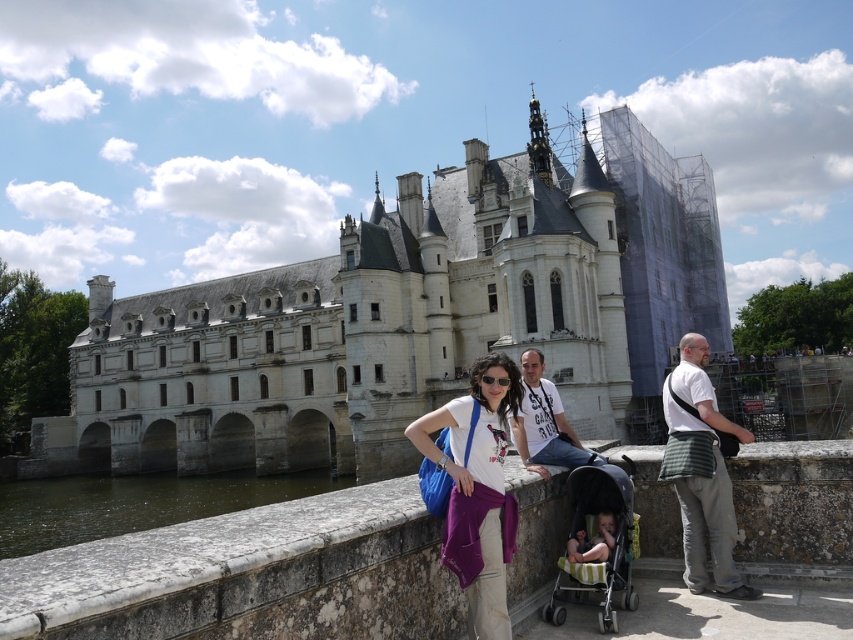
Is striped fabric bag at right bigger than white cotton t-shirt at center?

No, striped fabric bag at right is not bigger than white cotton t-shirt at center.

Measure the distance from striped fabric bag at right to white cotton t-shirt at center.

striped fabric bag at right is 22.55 feet away from white cotton t-shirt at center.

Is point (699, 486) positioned behind point (541, 435)?

That is False.

You are a GUI agent. You are given a task and a screenshot of the screen. Output one action in this format:
    pyautogui.click(x=<x>, y=<y>)
    Task: Click on the striped fabric bag at right
    
    Given the screenshot: What is the action you would take?
    pyautogui.click(x=701, y=472)

Is striped fabric bag at right wider than green striped fabric stroller at center?

Incorrect, striped fabric bag at right's width does not surpass green striped fabric stroller at center's.

Consider the image. Is striped fabric bag at right to the right of green striped fabric stroller at center from the viewer's perspective?

Yes, striped fabric bag at right is to the right of green striped fabric stroller at center.

Which is behind, point (680, 419) or point (610, 465)?

The point (680, 419) is more distant.

Identify the location of striped fabric bag at right. (701, 472).

Is point (96, 637) farther from viewer compared to point (560, 444)?

No, it is not.

Is stone ledge at center shorter than white cotton t-shirt at center?

No.

Identify the location of stone ledge at center. (248, 576).